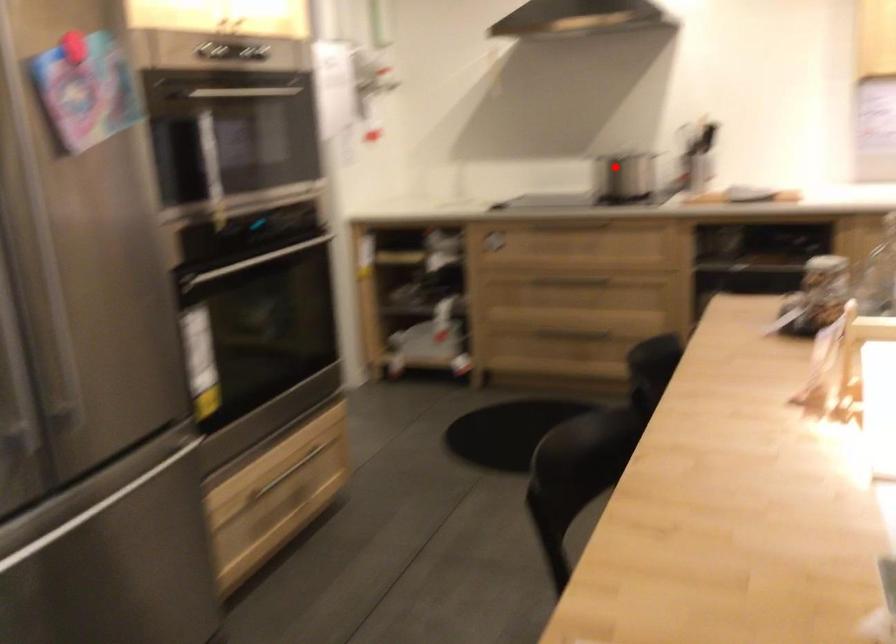
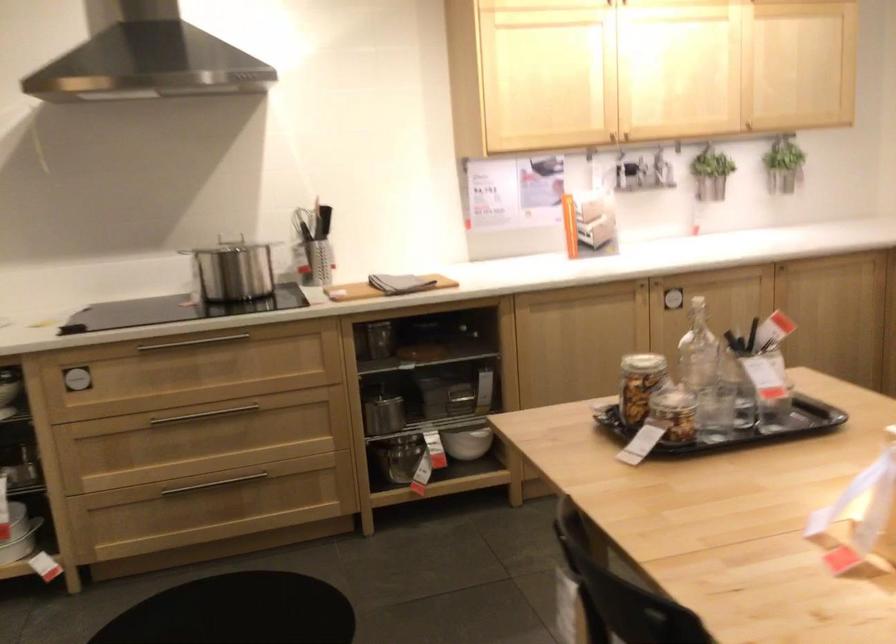
Question: A red point is marked in image1. In image2, is the corresponding 3D point closer to the camera or farther? Reply with the corresponding letter.

Choices:
 (A) The corresponding 3D point is closer.
 (B) The corresponding 3D point is farther.

Answer: (A)